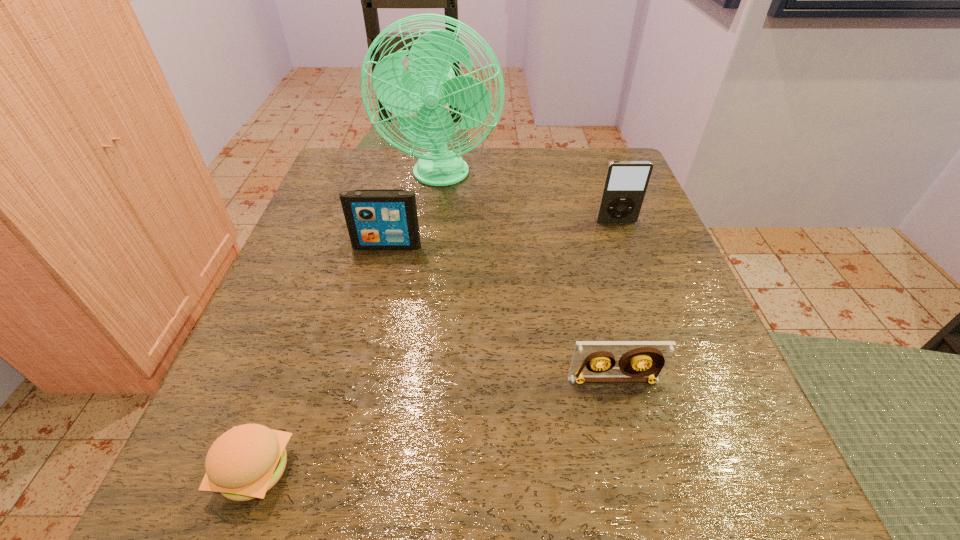
This screenshot has width=960, height=540. I want to click on iPod present at the right edge, so click(625, 184).

Where is `videotape that is at the right edge`? This screenshot has height=540, width=960. videotape that is at the right edge is located at coordinates (642, 361).

Find the location of `object that is at the far left corner`. object that is at the far left corner is located at coordinates (430, 83).

Locate an element on the screen. The height and width of the screenshot is (540, 960). object at the near left corner is located at coordinates (245, 462).

In the image, there is a desktop. What are the coordinates of `free space at the far edge` in the screenshot? It's located at (547, 202).

The width and height of the screenshot is (960, 540). I want to click on free region at the near edge, so click(331, 507).

Identify the location of vacant region at the left edge. This screenshot has height=540, width=960. (303, 368).

The image size is (960, 540). In the image, there is a desktop. Find the location of `vacant space at the right edge`. vacant space at the right edge is located at coordinates (670, 429).

In the image, there is a desktop. Where is `vacant region at the far left corner`? The image size is (960, 540). vacant region at the far left corner is located at coordinates (379, 151).

Image resolution: width=960 pixels, height=540 pixels. Find the location of `free space at the far right corner of the desktop`. free space at the far right corner of the desktop is located at coordinates (578, 198).